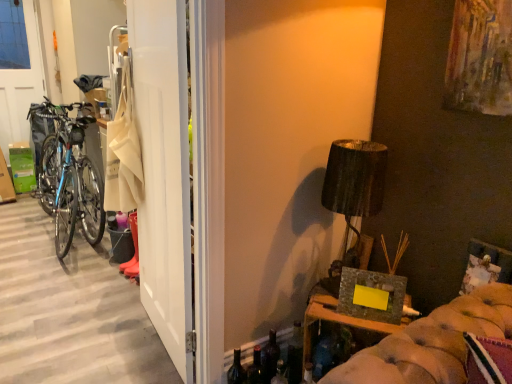
Question: From the image's perspective, does shiny blue frame bicycle at left appear higher than white matte door at left?

Choices:
 (A) yes
 (B) no

Answer: (A)

Question: Considering the relative positions of shiny blue frame bicycle at left and white matte door at left in the image provided, is shiny blue frame bicycle at left in front of white matte door at left?

Choices:
 (A) yes
 (B) no

Answer: (B)

Question: Is the position of shiny blue frame bicycle at left more distant than that of white matte door at left?

Choices:
 (A) no
 (B) yes

Answer: (B)

Question: Is shiny blue frame bicycle at left positioned far away from white matte door at left?

Choices:
 (A) no
 (B) yes

Answer: (B)

Question: Can you confirm if shiny blue frame bicycle at left is bigger than white matte door at left?

Choices:
 (A) yes
 (B) no

Answer: (A)

Question: Is shiny blue frame bicycle at left not within white matte door at left?

Choices:
 (A) no
 (B) yes

Answer: (B)

Question: Considering the relative sizes of white matte door at left and translucent glass bottle at lower center, the 3th bottle from the right, in the image provided, is white matte door at left taller than translucent glass bottle at lower center, the 3th bottle from the right,?

Choices:
 (A) yes
 (B) no

Answer: (A)

Question: Is white matte door at left at the left side of translucent glass bottle at lower center, the 3th bottle from the right?

Choices:
 (A) yes
 (B) no

Answer: (A)

Question: Is white matte door at left in front of translucent glass bottle at lower center, acting as the first bottle starting from the left?

Choices:
 (A) yes
 (B) no

Answer: (A)

Question: Is white matte door at left facing towards translucent glass bottle at lower center, the 3th bottle from the right?

Choices:
 (A) yes
 (B) no

Answer: (B)

Question: From a real-world perspective, is white matte door at left on translucent glass bottle at lower center, the 3th bottle from the right?

Choices:
 (A) no
 (B) yes

Answer: (B)

Question: From a real-world perspective, is white matte door at left positioned under translucent glass bottle at lower center, the 3th bottle from the right, based on gravity?

Choices:
 (A) no
 (B) yes

Answer: (A)

Question: Is translucent glass bottle at lower center, the 3th bottle from the right, positioned far away from white matte door at left?

Choices:
 (A) no
 (B) yes

Answer: (A)